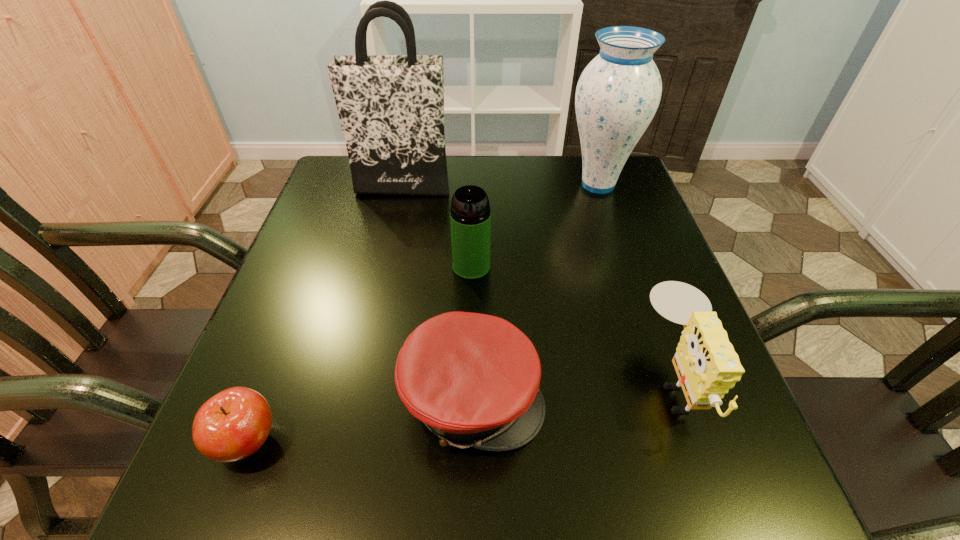
The width and height of the screenshot is (960, 540). In order to click on shopping bag in this screenshot , I will do `click(391, 107)`.

What are the coordinates of `vase` in the screenshot? It's located at (617, 95).

The height and width of the screenshot is (540, 960). Find the location of `thermos bottle`. thermos bottle is located at coordinates (470, 216).

Image resolution: width=960 pixels, height=540 pixels. Find the location of `the fourth nearest object`. the fourth nearest object is located at coordinates (470, 216).

Image resolution: width=960 pixels, height=540 pixels. I want to click on the third shortest object, so click(707, 366).

Where is `cap`? This screenshot has width=960, height=540. cap is located at coordinates [x=473, y=379].

Where is `apple`? This screenshot has height=540, width=960. apple is located at coordinates (232, 425).

The image size is (960, 540). Find the location of `free region located 0.200m on the front of the shopping bag with the design`. free region located 0.200m on the front of the shopping bag with the design is located at coordinates (389, 249).

Identify the location of vacant space positioned 0.380m on the left of the vase. (418, 185).

This screenshot has height=540, width=960. I want to click on vacant area located from the spout of the thermos bottle, so click(468, 453).